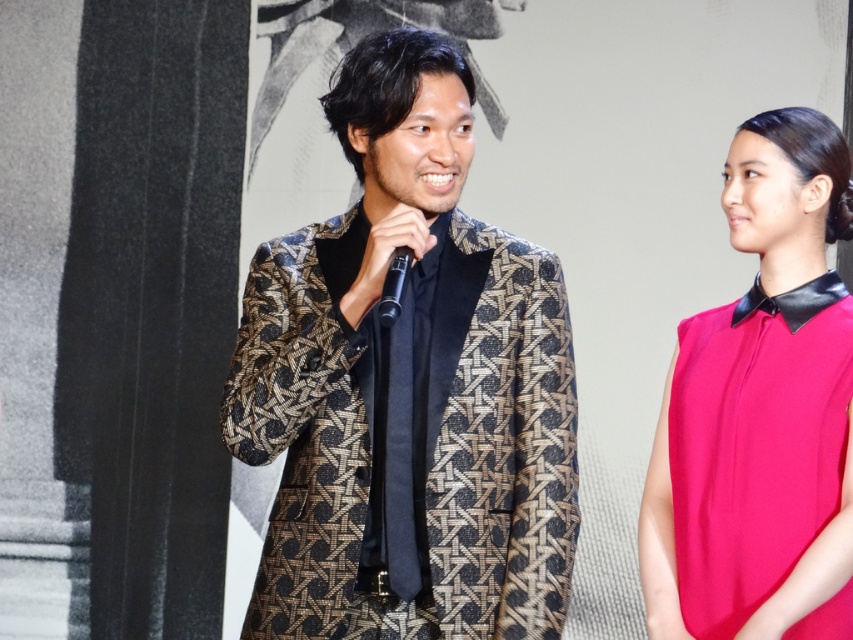
Which is behind, point (450, 536) or point (810, 196)?

The point (810, 196) is more distant.

Can you confirm if gold-patterned suit at center is positioned below matte pink blouse at right?

No.

What do you see at coordinates (407, 387) in the screenshot?
I see `gold-patterned suit at center` at bounding box center [407, 387].

Identify the location of gold-patterned suit at center. (407, 387).